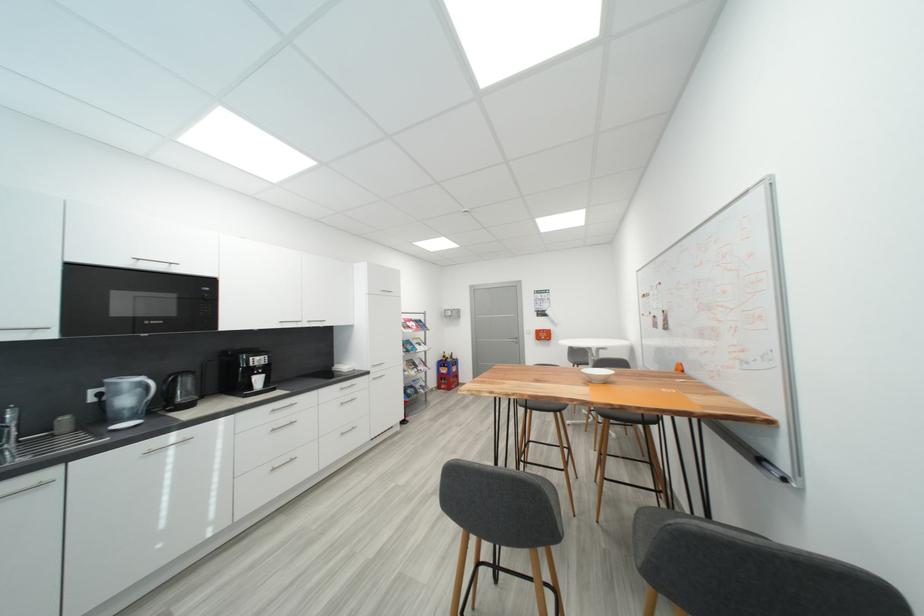
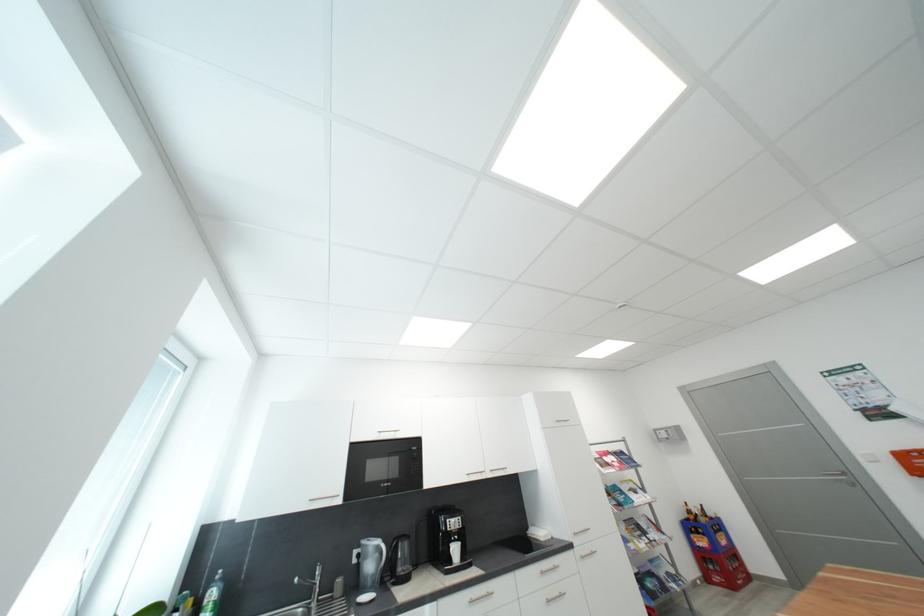
In the second image, find the point that corresponds to pixel 456 362 in the first image.

(710, 522)